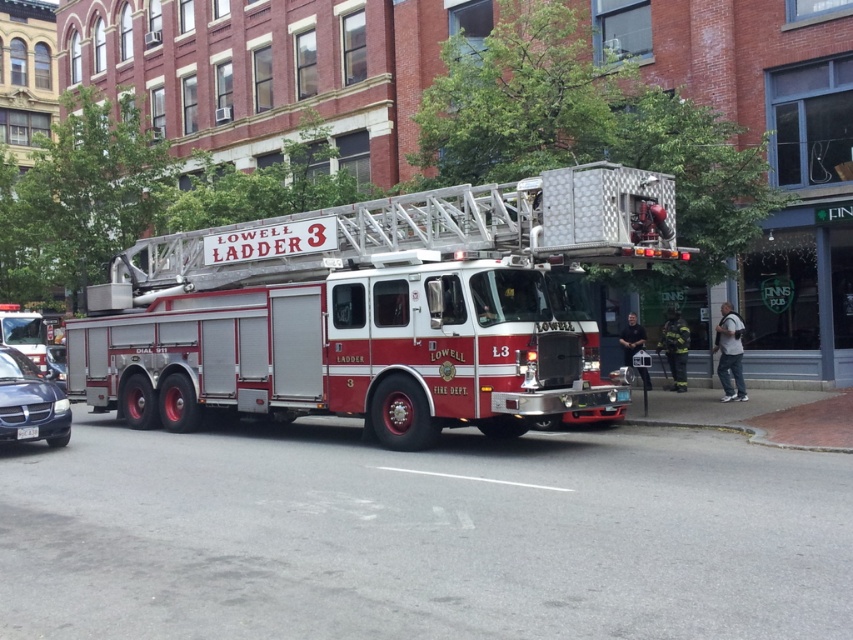
Between point (51, 388) and point (30, 429), which one is positioned behind?

The point (51, 388) is more distant.

Can you confirm if metallic blue sedan at lower left is positioned to the left of white plastic license plate at center?

Correct, you'll find metallic blue sedan at lower left to the left of white plastic license plate at center.

The height and width of the screenshot is (640, 853). In order to click on metallic blue sedan at lower left in this screenshot , I will do `click(30, 401)`.

Does red metallic fire truck at center have a larger size compared to metallic blue sedan at lower left?

Correct, red metallic fire truck at center is larger in size than metallic blue sedan at lower left.

Which is behind, point (482, 296) or point (22, 394)?

Point (22, 394)

Find the location of `red metallic fire truck at center`. red metallic fire truck at center is located at coordinates (374, 308).

Who is positioned more to the right, red metallic fire truck at center or metallic silver fire truck at left?

red metallic fire truck at center is more to the right.

This screenshot has height=640, width=853. What do you see at coordinates (374, 308) in the screenshot?
I see `red metallic fire truck at center` at bounding box center [374, 308].

This screenshot has width=853, height=640. In order to click on red metallic fire truck at center in this screenshot , I will do `click(374, 308)`.